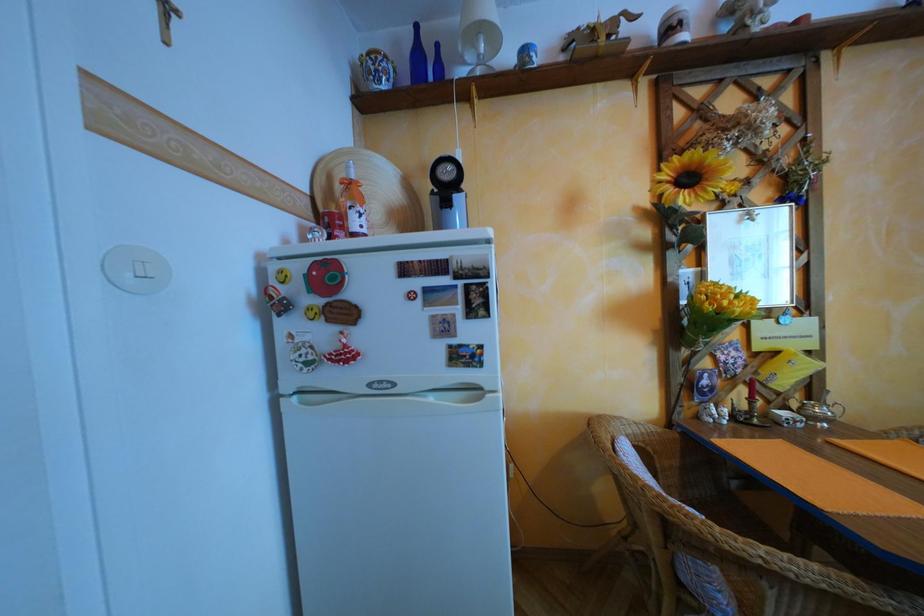
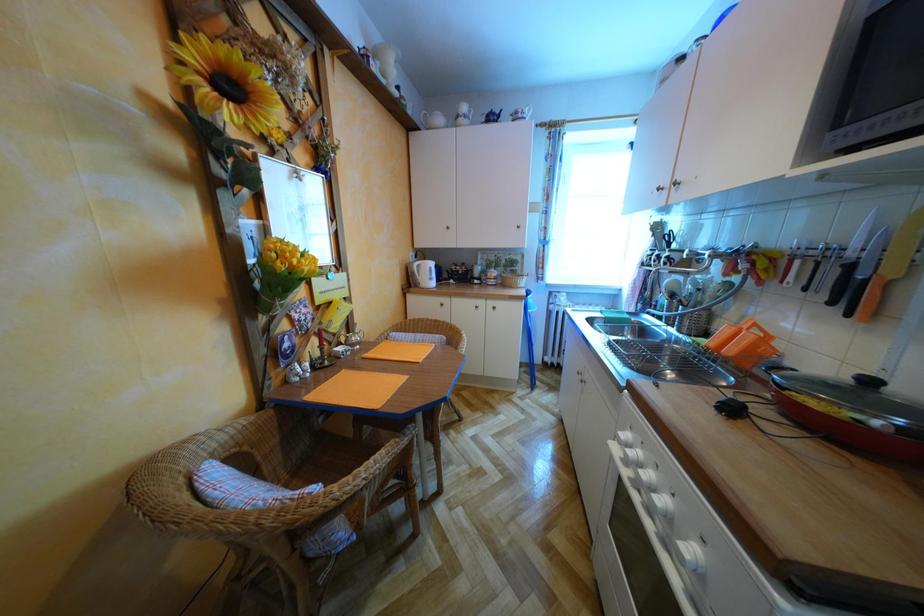
Question: The camera is either moving clockwise (left) or counter-clockwise (right) around the object. The first image is from the beginning of the video and the second image is from the end. Is the camera moving left or right when shooting the video?

Choices:
 (A) Left
 (B) Right

Answer: (A)